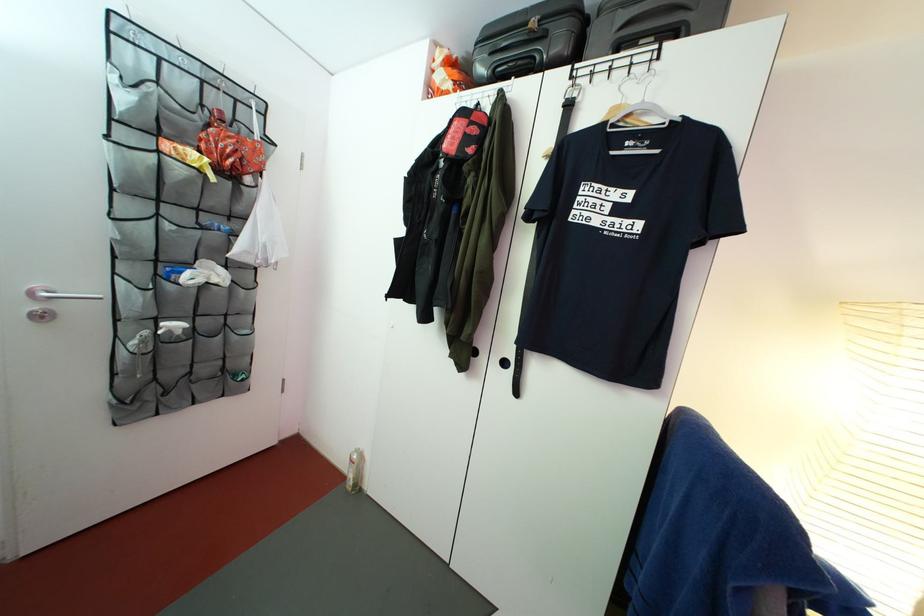
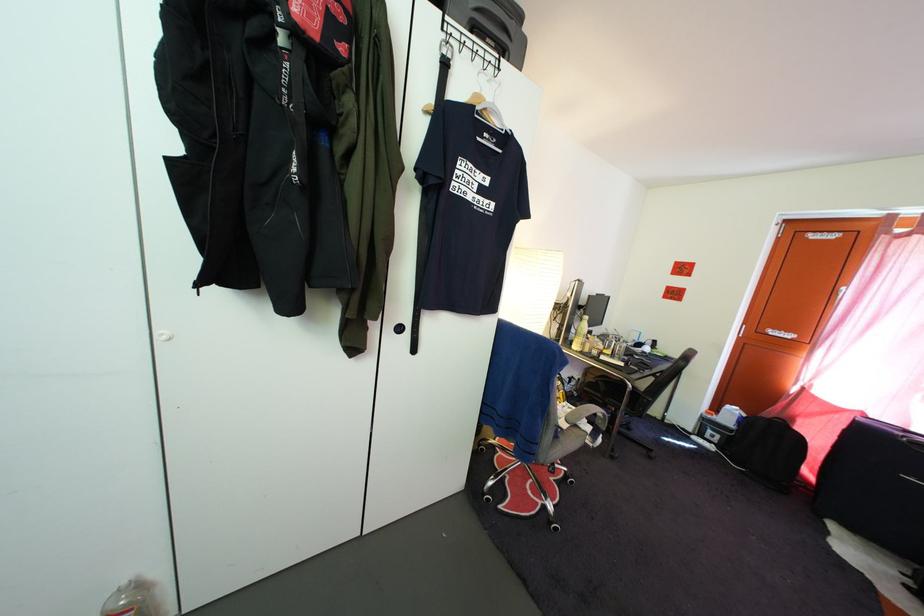
Locate, in the second image, the point that corresponds to [638,123] in the first image.

(494, 118)